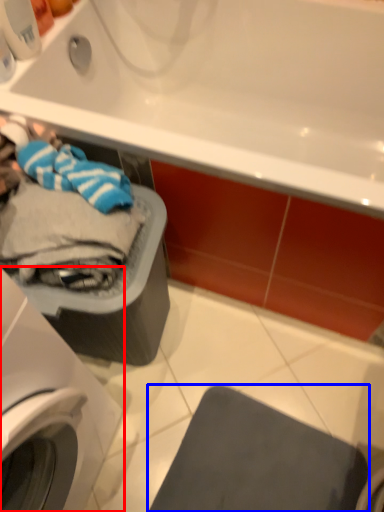
Question: Which point is closer to the camera, washing machine (highlighted by a red box) or gray (highlighted by a blue box)?

Choices:
 (A) washing machine
 (B) gray

Answer: (A)